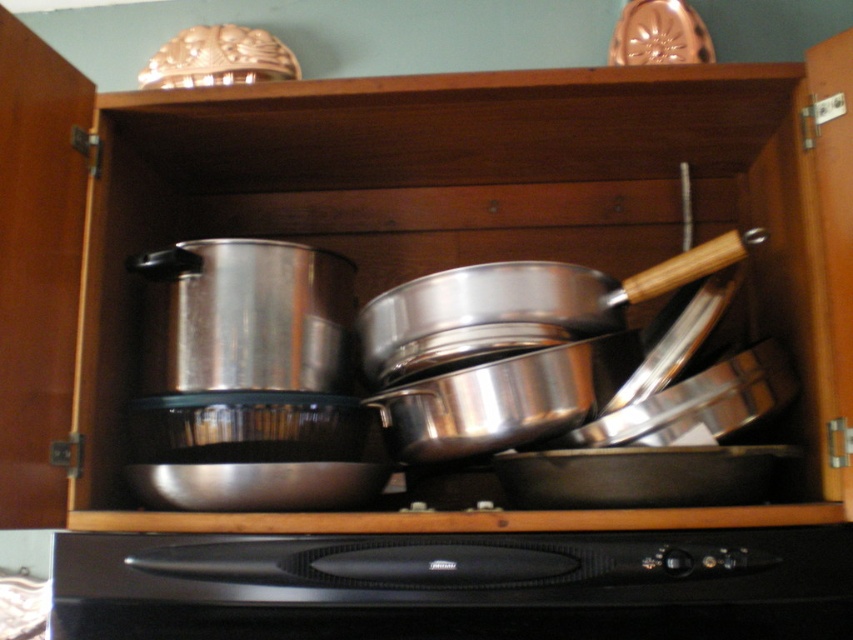
You are trying to determine if the black matte oven at bottom can fit under a shelf that has a height limit of 10 inches. The shiny silver frying pan at center is 12 inches tall. Can the oven fit under the shelf?

The black matte oven at bottom is not as tall as the shiny silver frying pan at center, which is 12 inches tall. Since the oven is shorter than the frying pan, it is likely under 12 inches and can fit under the 10 inch shelf. However, the exact height isn

You are a chef who needs to place a 10 inch diameter pot on the counter between the black matte oven at bottom and the shiny silver frying pan at center. Is there enough space?

The distance between the black matte oven at bottom and the shiny silver frying pan at center is 12.02 inches, so yes, the 10 inch diameter pot will fit in the space between them.